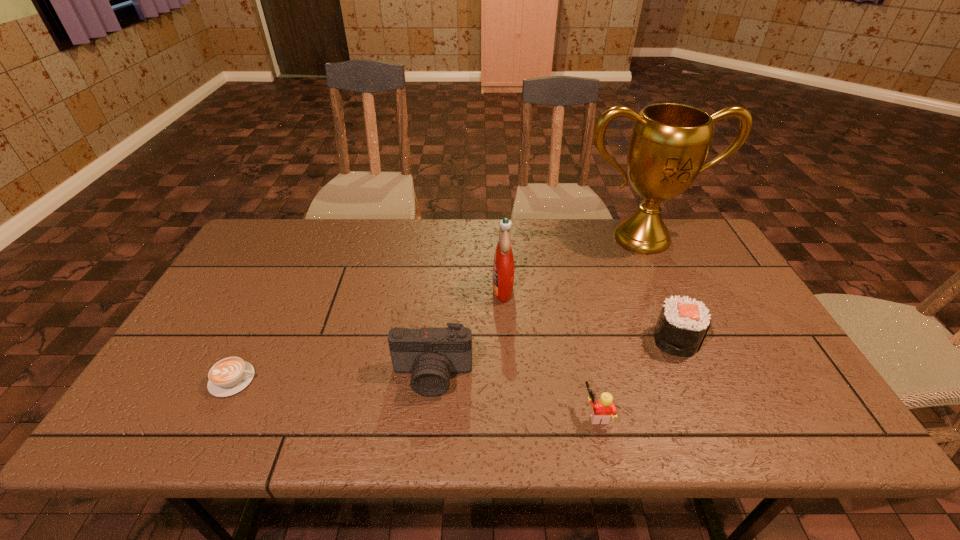
You are a GUI agent. You are given a task and a screenshot of the screen. Output one action in this format:
    pyautogui.click(x=<x>, y=<y>)
    Task: Click on the tallest object
    The width and height of the screenshot is (960, 540).
    Given the screenshot: What is the action you would take?
    pyautogui.click(x=669, y=144)

Locate an element on the screen. The height and width of the screenshot is (540, 960). trophy cup is located at coordinates (669, 144).

Locate an element on the screen. Image resolution: width=960 pixels, height=540 pixels. the fifth shortest object is located at coordinates (503, 266).

At what (x,y) coordinates should I click in order to perform the action: click on the fifth nearest object. Please return your answer as a coordinate pair (x, y). The width and height of the screenshot is (960, 540). Looking at the image, I should click on (503, 266).

This screenshot has width=960, height=540. What are the coordinates of `camera` in the screenshot? It's located at (430, 354).

Find the location of a particular element. The image size is (960, 540). sushi is located at coordinates (682, 325).

Locate an element on the screen. The height and width of the screenshot is (540, 960). the third object from right to left is located at coordinates (604, 407).

Where is `Lego`? Image resolution: width=960 pixels, height=540 pixels. Lego is located at coordinates (604, 407).

Locate an element on the screen. The image size is (960, 540). the leftmost object is located at coordinates (228, 376).

At what (x,y) coordinates should I click in order to perform the action: click on the shortest object. Please return your answer as a coordinate pair (x, y). Image resolution: width=960 pixels, height=540 pixels. Looking at the image, I should click on (228, 376).